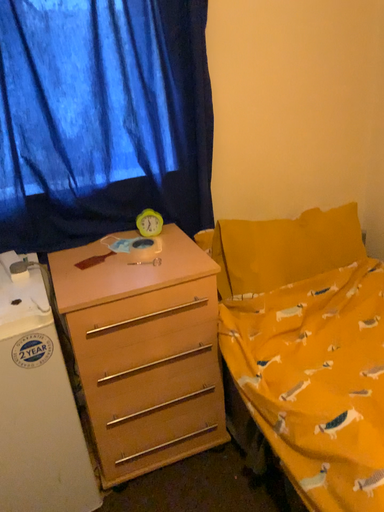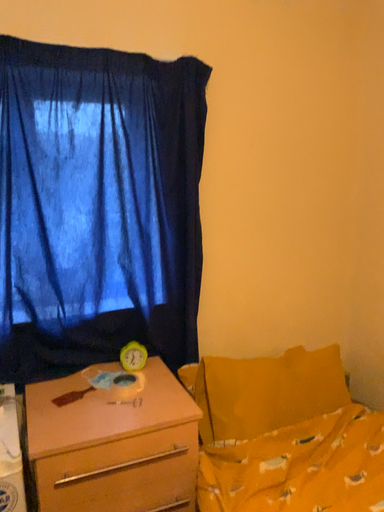
Question: Which way did the camera rotate in the video?

Choices:
 (A) rotated upward
 (B) rotated downward

Answer: (A)